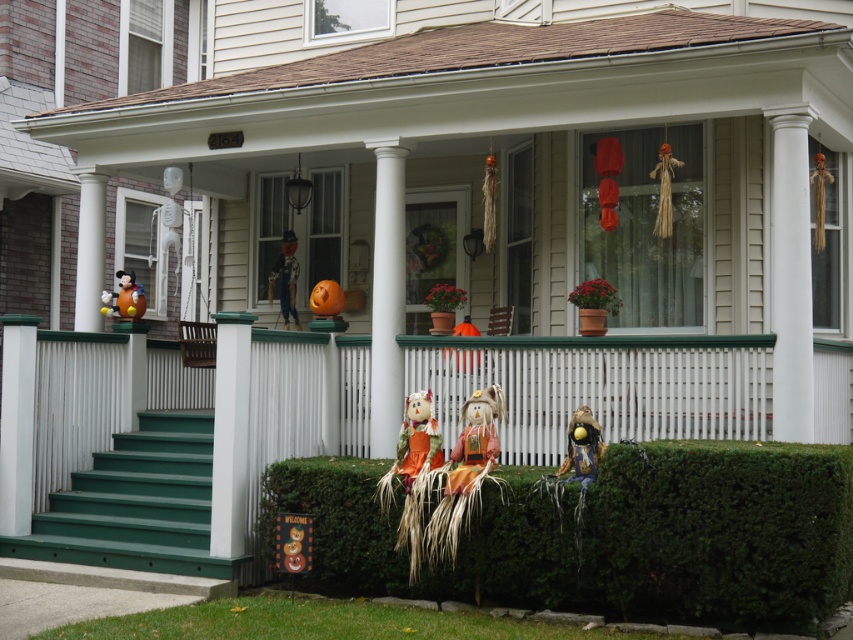
Question: Does green wood porch at lower center appear over matte plastic mickey mouse at left?

Choices:
 (A) yes
 (B) no

Answer: (B)

Question: Which is farther from the green painted wood stairs at lower left?

Choices:
 (A) shiny metallic scarecrow at lower center
 (B) orange fabric scarecrow at center
 (C) green wood porch at lower center

Answer: (C)

Question: Is green painted wood stairs at lower left further to camera compared to matte plastic mickey mouse at left?

Choices:
 (A) no
 (B) yes

Answer: (A)

Question: Among these points, which one is nearest to the camera?

Choices:
 (A) coord(112,497)
 (B) coord(223,483)
 (C) coord(583,448)

Answer: (C)

Question: Which point appears closest to the camera in this image?

Choices:
 (A) (439, 461)
 (B) (589, 432)
 (C) (312, 308)

Answer: (B)

Question: Is orange fabric scarecrow at center thinner than orange matte pumpkin at center?

Choices:
 (A) yes
 (B) no

Answer: (B)